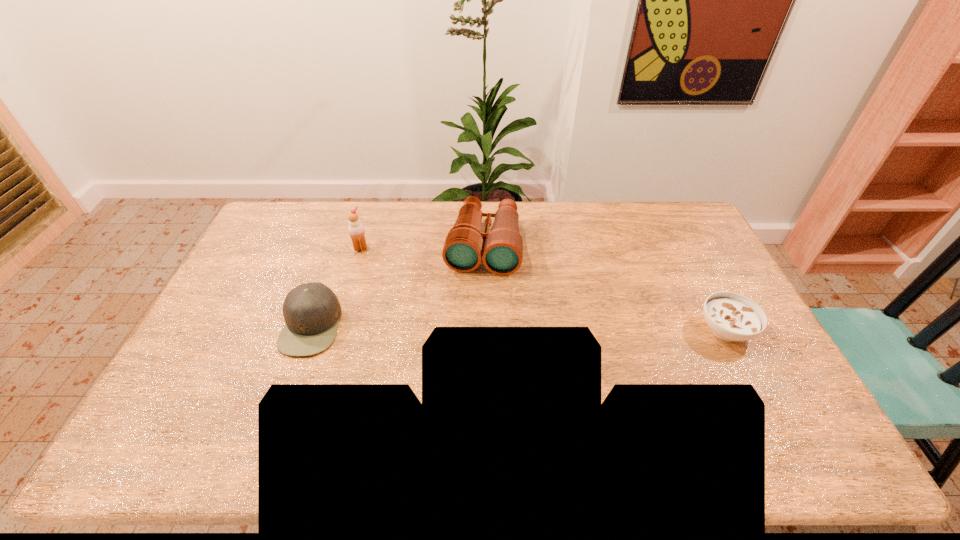
Identify the location of free spot located through the lenses of the binoculars. The image size is (960, 540). (466, 363).

What are the coordinates of `free space located 0.340m through the lenses of the binoculars` in the screenshot? It's located at (466, 363).

The width and height of the screenshot is (960, 540). Identify the location of vacant area situated through the lenses of the binoculars. (470, 332).

Locate an element on the screen. vacant area located at the front with a straw on the icecream is located at coordinates click(426, 294).

The image size is (960, 540). In order to click on free space located 0.310m at the front with a straw on the icecream in this screenshot , I will do `click(426, 294)`.

I want to click on vacant space positioned 0.090m at the front with a straw on the icecream, so click(x=382, y=263).

In order to click on object at the far edge in this screenshot , I will do `click(501, 250)`.

Identify the location of object that is at the right edge. The image size is (960, 540). (730, 316).

In the image, there is a desktop. At what (x,y) coordinates should I click in order to perform the action: click on free space at the far edge. Please return your answer as a coordinate pair (x, y). Looking at the image, I should click on (539, 226).

The image size is (960, 540). In the image, there is a desktop. In order to click on blank space at the near edge in this screenshot , I will do `click(415, 416)`.